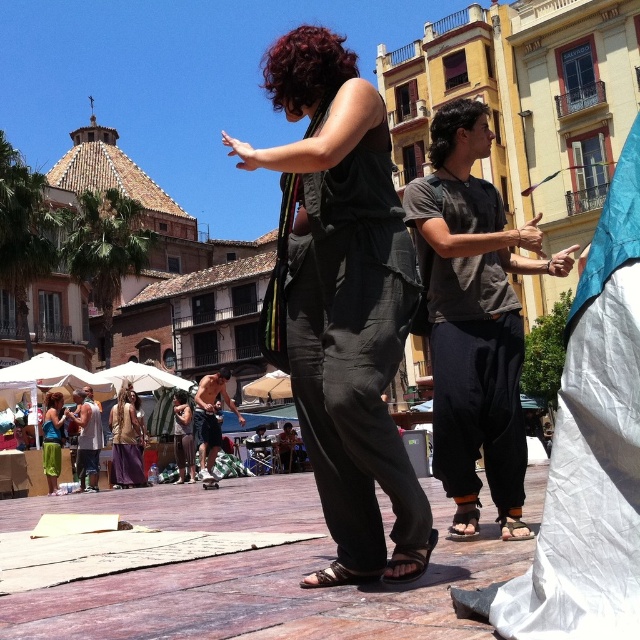
Can you confirm if matte black jumpsuit at center is shorter than gray tank top at lower left?

Incorrect, matte black jumpsuit at center's height does not fall short of gray tank top at lower left's.

Can you confirm if matte black jumpsuit at center is taller than gray tank top at lower left?

Indeed, matte black jumpsuit at center has a greater height compared to gray tank top at lower left.

The height and width of the screenshot is (640, 640). What do you see at coordinates (342, 301) in the screenshot?
I see `matte black jumpsuit at center` at bounding box center [342, 301].

Locate an element on the screen. matte black jumpsuit at center is located at coordinates (342, 301).

Can you confirm if dark gray cotton shirt at center is wider than shiny metallic shorts at center?

Yes, dark gray cotton shirt at center is wider than shiny metallic shorts at center.

Who is more forward, (502, 298) or (196, 412)?

Positioned in front is point (502, 298).

What do you see at coordinates (474, 317) in the screenshot?
I see `dark gray cotton shirt at center` at bounding box center [474, 317].

Locate an element on the screen. dark gray cotton shirt at center is located at coordinates (474, 317).

Looking at this image, is gray tank top at lower left above green fabric skirt at lower left?

Correct, gray tank top at lower left is located above green fabric skirt at lower left.

Can you confirm if gray tank top at lower left is bigger than green fabric skirt at lower left?

Indeed, gray tank top at lower left has a larger size compared to green fabric skirt at lower left.

Does point (97, 456) come closer to viewer compared to point (54, 429)?

Yes.

This screenshot has width=640, height=640. What are the coordinates of `gray tank top at lower left` in the screenshot? It's located at (88, 436).